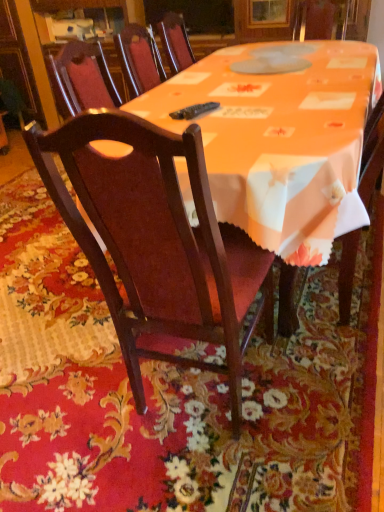
Question: From their relative heights in the image, would you say glossy wood cabinet at upper left is taller or shorter than mahogany wood chair at center?

Choices:
 (A) short
 (B) tall

Answer: (B)

Question: From a real-world perspective, is glossy wood cabinet at upper left above or below mahogany wood chair at center?

Choices:
 (A) above
 (B) below

Answer: (A)

Question: Is glossy wood cabinet at upper left wider or thinner than mahogany wood chair at center?

Choices:
 (A) wide
 (B) thin

Answer: (A)

Question: Considering the relative positions of mahogany wood chair at center and glossy wood cabinet at upper left in the image provided, is mahogany wood chair at center to the left or to the right of glossy wood cabinet at upper left?

Choices:
 (A) left
 (B) right

Answer: (B)

Question: Which is correct: mahogany wood chair at center is inside glossy wood cabinet at upper left, or outside of it?

Choices:
 (A) outside
 (B) inside

Answer: (A)

Question: Is point (134, 304) positioned closer to the camera than point (23, 56)?

Choices:
 (A) closer
 (B) farther

Answer: (A)

Question: Is mahogany wood chair at center wider or thinner than glossy wood cabinet at upper left?

Choices:
 (A) wide
 (B) thin

Answer: (B)